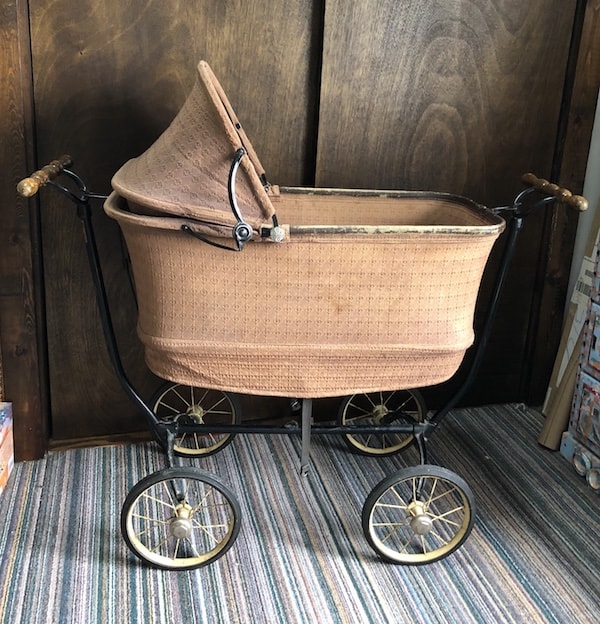
I want to click on handle, so tap(39, 177).